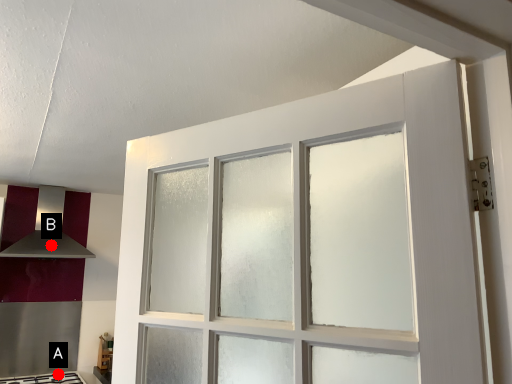
Question: Two points are circled on the image, labeled by A and B beside each circle. Which point is farther to the camera?

Choices:
 (A) A is further
 (B) B is further

Answer: (B)